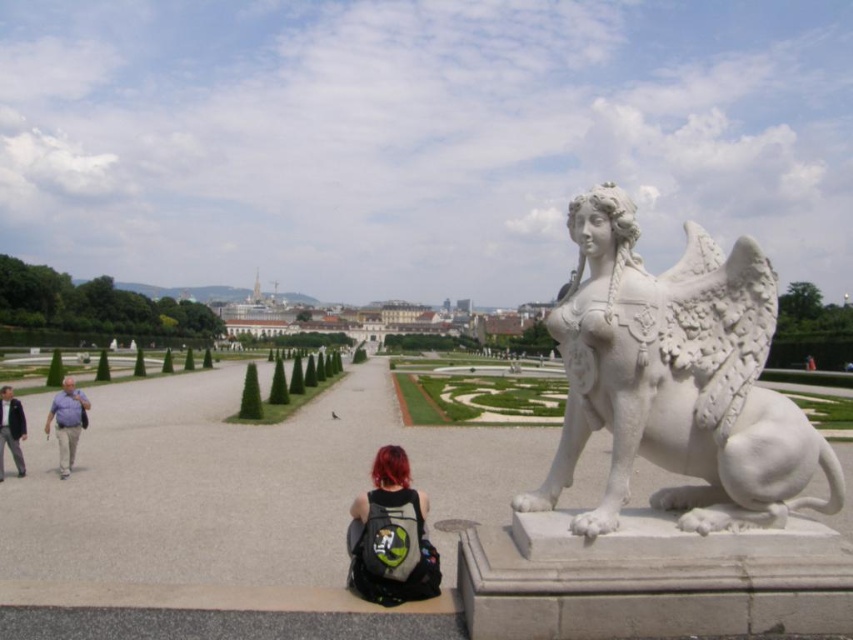
Question: Which point appears closest to the camera in this image?

Choices:
 (A) (x=381, y=528)
 (B) (x=61, y=468)
 (C) (x=635, y=454)

Answer: (C)

Question: Does white marble sphinx at center come in front of light brown leather jacket at lower left?

Choices:
 (A) yes
 (B) no

Answer: (A)

Question: Can you confirm if shiny black backpack at center is thinner than matte gray shirt at left?

Choices:
 (A) yes
 (B) no

Answer: (A)

Question: Is shiny black backpack at center to the left of light brown leather jacket at lower left from the viewer's perspective?

Choices:
 (A) no
 (B) yes

Answer: (A)

Question: Which object is positioned closest to the shiny black backpack at center?

Choices:
 (A) matte gray shirt at left
 (B) light brown leather jacket at lower left

Answer: (B)

Question: Which point appears closest to the camera in this image?

Choices:
 (A) (747, 468)
 (B) (0, 412)
 (C) (355, 580)

Answer: (A)